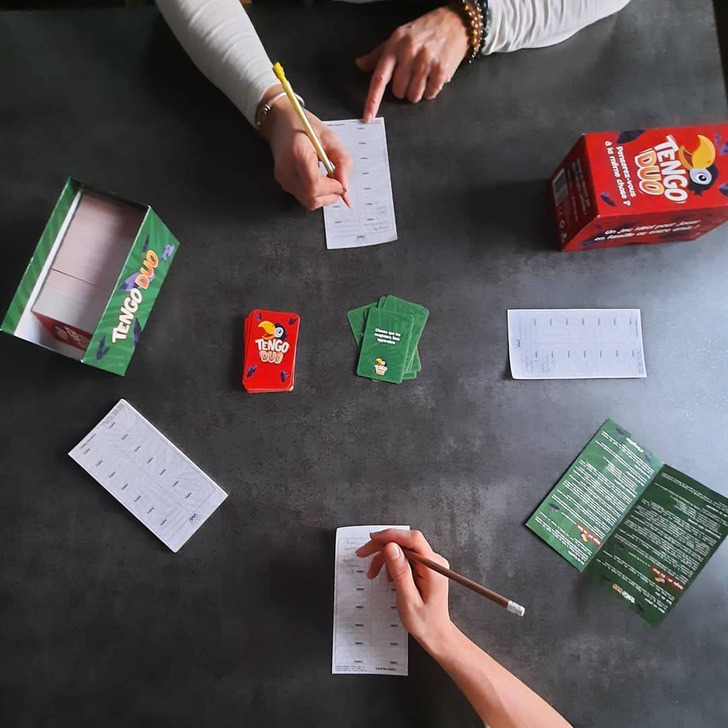
Locate an element on the screen. This screenshot has height=728, width=728. green box filled with playing cards is located at coordinates (138, 325).